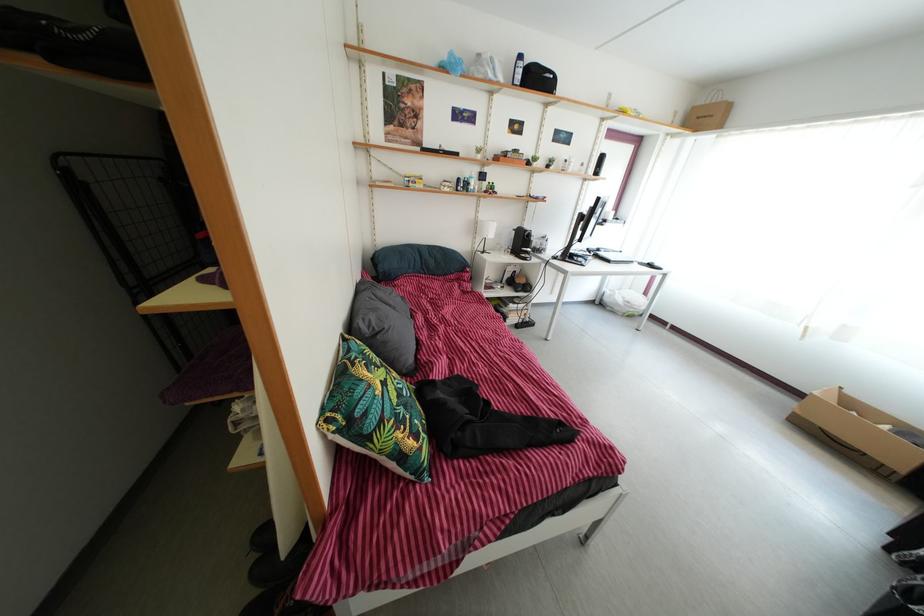
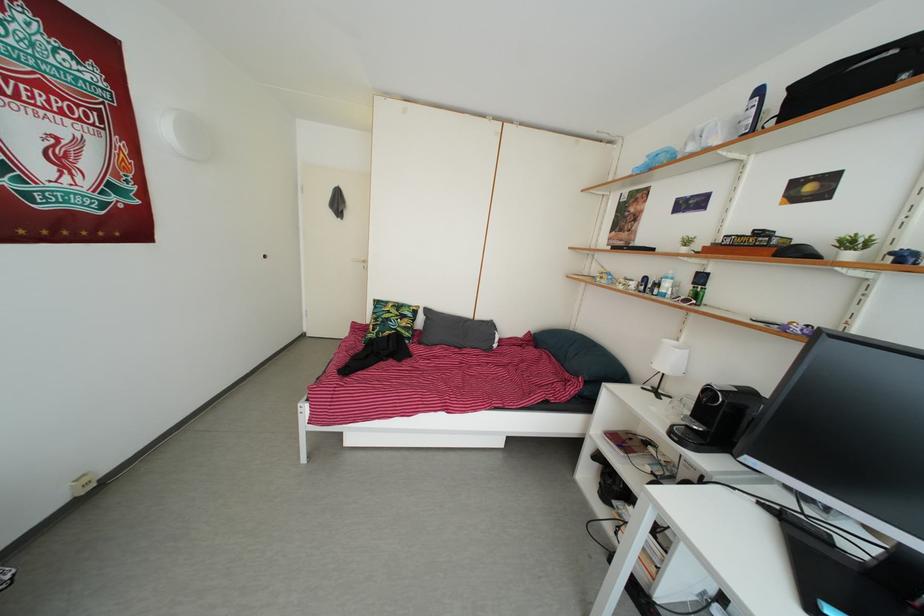
In the second image, find the point that corresponds to [411,416] in the first image.

(388, 330)